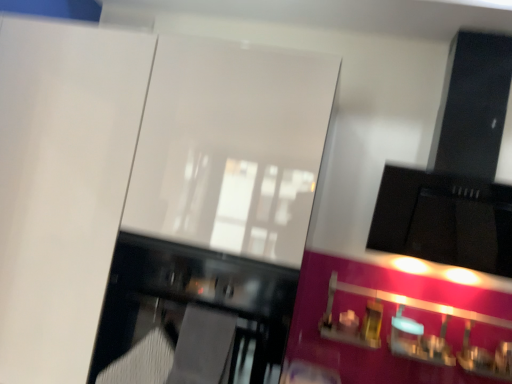
What is the approximate height of pink glossy cabinet at lower right?

26.86 centimeters.

Describe the element at coordinates (394, 327) in the screenshot. I see `pink glossy cabinet at lower right` at that location.

This screenshot has height=384, width=512. Identify the location of pink glossy cabinet at lower right. (394, 327).

This screenshot has width=512, height=384. In order to click on glossy black oven at lower left in this screenshot , I will do `click(186, 304)`.

Describe the element at coordinates (186, 304) in the screenshot. The height and width of the screenshot is (384, 512). I see `glossy black oven at lower left` at that location.

I want to click on pink glossy cabinet at lower right, so 394,327.

Between pink glossy cabinet at lower right and glossy black oven at lower left, which one appears on the right side from the viewer's perspective?

From the viewer's perspective, pink glossy cabinet at lower right appears more on the right side.

Is pink glossy cabinet at lower right positioned behind glossy black oven at lower left?

Yes.

Is point (463, 302) closer or farther from the camera than point (279, 342)?

Point (463, 302).

From the image's perspective, is pink glossy cabinet at lower right above or below glossy black oven at lower left?

From the image's perspective, pink glossy cabinet at lower right appears below glossy black oven at lower left.

From a real-world perspective, is pink glossy cabinet at lower right located beneath glossy black oven at lower left?

Incorrect, from a real-world perspective, pink glossy cabinet at lower right is higher than glossy black oven at lower left.

Considering the relative sizes of pink glossy cabinet at lower right and glossy black oven at lower left in the image provided, is pink glossy cabinet at lower right wider than glossy black oven at lower left?

Incorrect, the width of pink glossy cabinet at lower right does not surpass that of glossy black oven at lower left.

Which of these two, pink glossy cabinet at lower right or glossy black oven at lower left, stands taller?

glossy black oven at lower left.

From the picture: Which of these two, pink glossy cabinet at lower right or glossy black oven at lower left, is bigger?

glossy black oven at lower left.

In the scene shown: Is pink glossy cabinet at lower right not within glossy black oven at lower left?

Yes, pink glossy cabinet at lower right is not within glossy black oven at lower left.

Is there a large distance between pink glossy cabinet at lower right and glossy black oven at lower left?

No, pink glossy cabinet at lower right is not far from glossy black oven at lower left.

Is glossy black oven at lower left at the back of pink glossy cabinet at lower right?

No, glossy black oven at lower left is not at the back of pink glossy cabinet at lower right.

What's the angular difference between pink glossy cabinet at lower right and glossy black oven at lower left's facing directions?

The facing directions of pink glossy cabinet at lower right and glossy black oven at lower left are 0.641 degrees apart.

Locate an element on the screen. furniture in front of the pink glossy cabinet at lower right is located at coordinates (186, 304).

Is glossy black oven at lower left at the right side of pink glossy cabinet at lower right?

No.

Is glossy black oven at lower left closer to the viewer compared to pink glossy cabinet at lower right?

Yes.

Considering the points (284, 335) and (426, 315), which point is behind, point (284, 335) or point (426, 315)?

Positioned behind is point (426, 315).

From the image's perspective, relative to pink glossy cabinet at lower right, is glossy black oven at lower left above or below?

Clearly, from the image's perspective, glossy black oven at lower left is above pink glossy cabinet at lower right.

From a real-world perspective, relative to pink glossy cabinet at lower right, is glossy black oven at lower left vertically above or below?

Clearly, from a real-world perspective, glossy black oven at lower left is below pink glossy cabinet at lower right.

Is glossy black oven at lower left thinner than pink glossy cabinet at lower right?

Incorrect, the width of glossy black oven at lower left is not less than that of pink glossy cabinet at lower right.

Can you confirm if glossy black oven at lower left is taller than pink glossy cabinet at lower right?

Correct, glossy black oven at lower left is much taller as pink glossy cabinet at lower right.

Between glossy black oven at lower left and pink glossy cabinet at lower right, which one has smaller size?

With smaller size is pink glossy cabinet at lower right.

Would you say glossy black oven at lower left is outside pink glossy cabinet at lower right?

glossy black oven at lower left lies outside pink glossy cabinet at lower right's area.

Is glossy black oven at lower left beside pink glossy cabinet at lower right?

glossy black oven at lower left is not next to pink glossy cabinet at lower right, and they're not touching.

Could you tell me if glossy black oven at lower left is turned towards pink glossy cabinet at lower right?

No, glossy black oven at lower left is not aimed at pink glossy cabinet at lower right.

Can you tell me how much glossy black oven at lower left and pink glossy cabinet at lower right differ in facing direction?

The facing directions of glossy black oven at lower left and pink glossy cabinet at lower right are 0.641 degrees apart.

The height and width of the screenshot is (384, 512). I want to click on furniture below the pink glossy cabinet at lower right (from a real-world perspective), so click(x=186, y=304).

You are a GUI agent. You are given a task and a screenshot of the screen. Output one action in this format:
    pyautogui.click(x=<x>, y=<y>)
    Task: Click on the furniture that appears on the left of pink glossy cabinet at lower right
    This screenshot has height=384, width=512.
    Given the screenshot: What is the action you would take?
    pyautogui.click(x=186, y=304)

Where is `furniture above the pink glossy cabinet at lower right (from the image's perspective)`? The height and width of the screenshot is (384, 512). furniture above the pink glossy cabinet at lower right (from the image's perspective) is located at coordinates (186, 304).